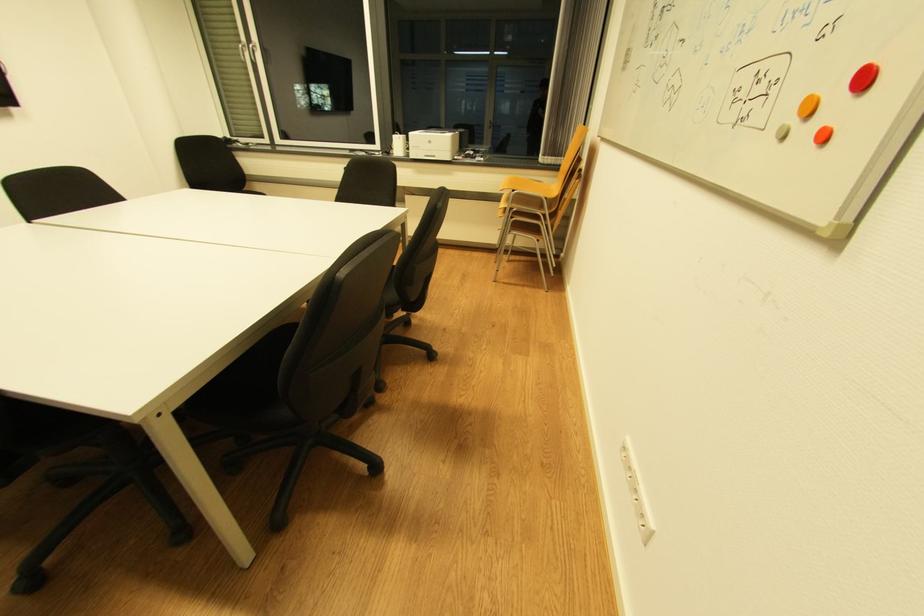
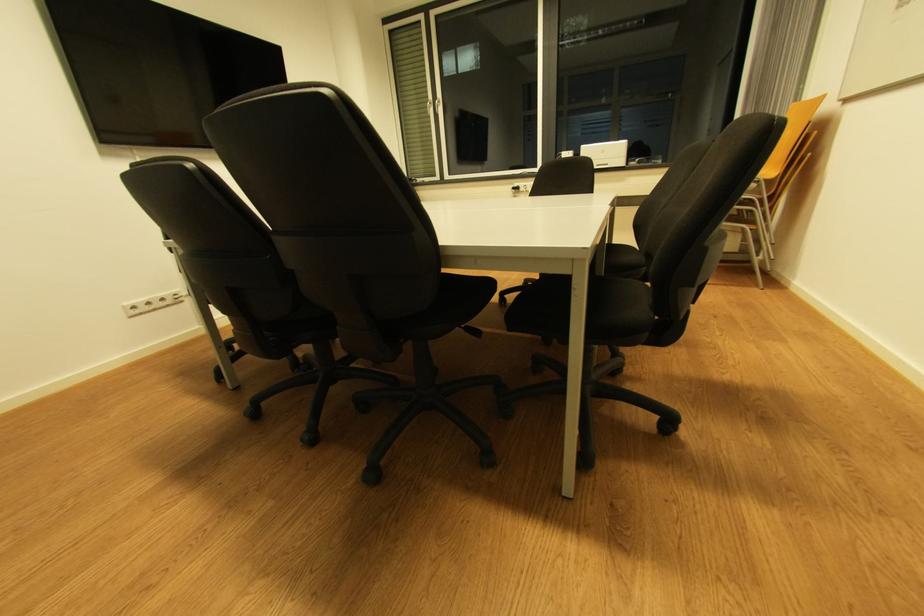
Question: The camera is either moving clockwise (left) or counter-clockwise (right) around the object. The first image is from the beginning of the video and the second image is from the end. Is the camera moving left or right when shooting the video?

Choices:
 (A) Left
 (B) Right

Answer: (B)